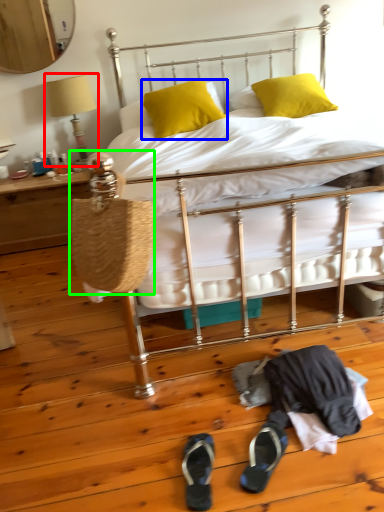
Question: Which is farther away from table lamp (highlighted by a red box)? pillow (highlighted by a blue box) or handbag (highlighted by a green box)?

Choices:
 (A) pillow
 (B) handbag

Answer: (B)